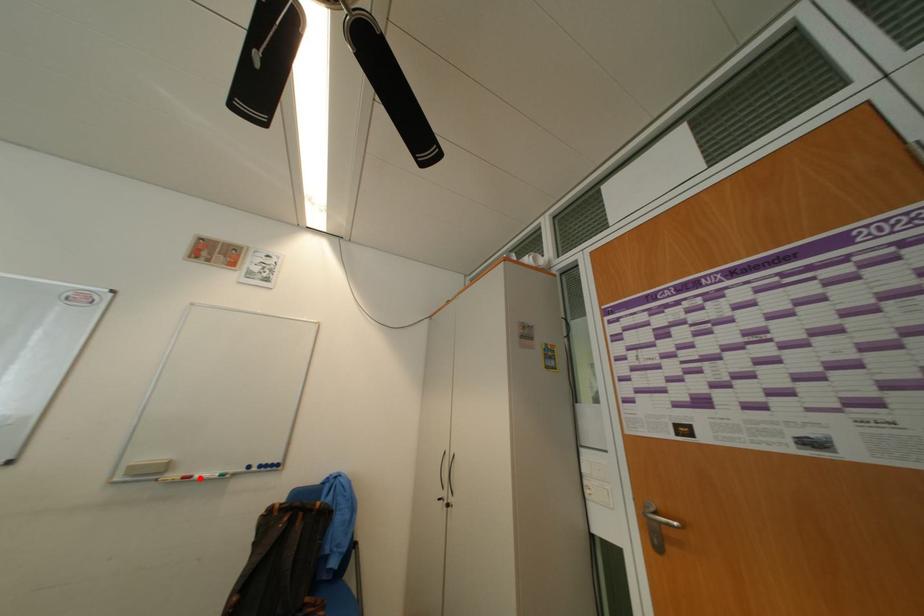
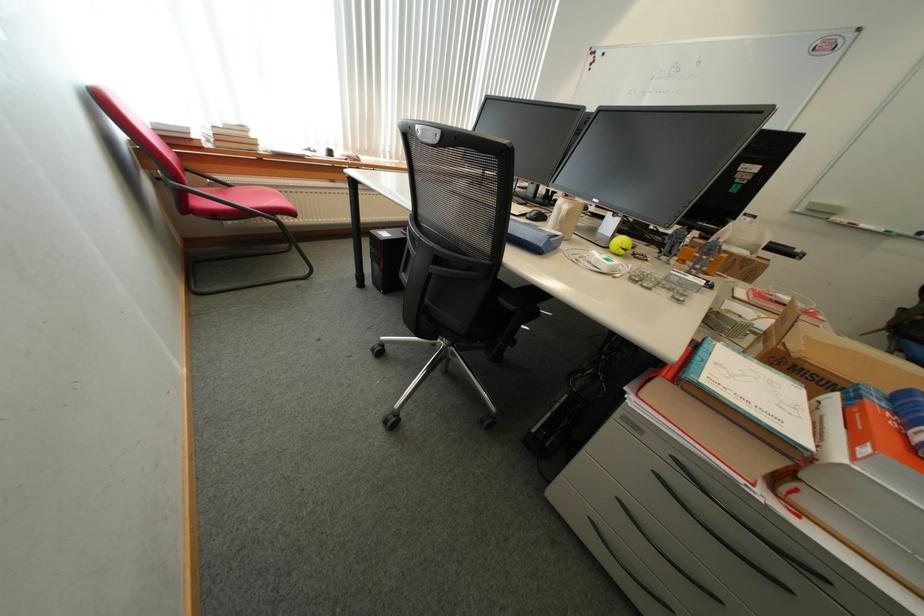
Find the pixel in the second image that matches the highlighted location in the first image.

(861, 225)